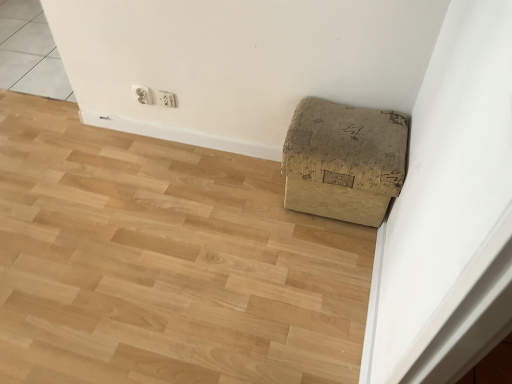
Question: Is brown cardboard box at lower right located outside white plastic electric outlet at upper center, the 2th electric outlet from the left?

Choices:
 (A) no
 (B) yes

Answer: (B)

Question: Is brown cardboard box at lower right to the left of white plastic electric outlet at upper center, the 2th electric outlet from the left, from the viewer's perspective?

Choices:
 (A) yes
 (B) no

Answer: (B)

Question: Is brown cardboard box at lower right facing away from white plastic electric outlet at upper center, the first electric outlet in the right-to-left sequence?

Choices:
 (A) no
 (B) yes

Answer: (A)

Question: Does brown cardboard box at lower right have a smaller size compared to white plastic electric outlet at upper center, the 2th electric outlet from the left?

Choices:
 (A) no
 (B) yes

Answer: (A)

Question: Are brown cardboard box at lower right and white plastic electric outlet at upper center, the 2th electric outlet from the left, far apart?

Choices:
 (A) no
 (B) yes

Answer: (A)

Question: Is brown cardboard box at lower right at the right side of white plastic electric outlet at upper center, the 2th electric outlet from the left?

Choices:
 (A) yes
 (B) no

Answer: (A)

Question: Is brown cardboard box at lower right positioned with its back to brown cardboard box at lower right?

Choices:
 (A) yes
 (B) no

Answer: (B)

Question: Can brown cardboard box at lower right be found inside brown cardboard box at lower right?

Choices:
 (A) no
 (B) yes

Answer: (A)

Question: Is brown cardboard box at lower right not close to brown cardboard box at lower right?

Choices:
 (A) yes
 (B) no

Answer: (B)

Question: From a real-world perspective, is brown cardboard box at lower right physically above brown cardboard box at lower right?

Choices:
 (A) no
 (B) yes

Answer: (A)

Question: Does brown cardboard box at lower right have a smaller size compared to brown cardboard box at lower right?

Choices:
 (A) no
 (B) yes

Answer: (A)

Question: Can you confirm if brown cardboard box at lower right is taller than brown cardboard box at lower right?

Choices:
 (A) yes
 (B) no

Answer: (B)

Question: Is white plastic electric outlet at upper center, the 2th electric outlet from the left, wider than brown cardboard box at lower right?

Choices:
 (A) yes
 (B) no

Answer: (B)